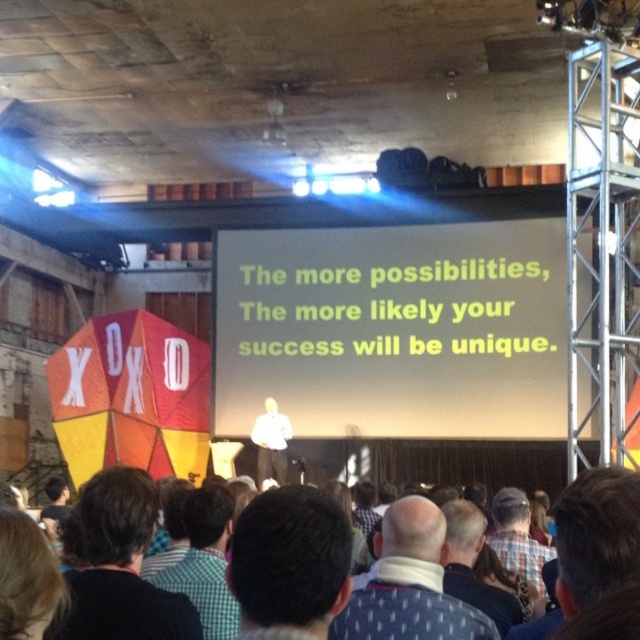
Can you confirm if brown hair at lower center is positioned to the left of white fabric at center?

Yes, brown hair at lower center is to the left of white fabric at center.

Is brown hair at lower center to the right of white fabric at center from the viewer's perspective?

In fact, brown hair at lower center is to the left of white fabric at center.

Which is in front, point (195, 636) or point (497, 634)?

Point (497, 634)

The width and height of the screenshot is (640, 640). I want to click on brown hair at lower center, so click(120, 566).

Who is shorter, checkered shirt at lower center or plaid shirt at center?

checkered shirt at lower center is shorter.

Is checkered shirt at lower center closer to the viewer compared to plaid shirt at center?

Yes.

Locate an element on the screen. checkered shirt at lower center is located at coordinates (205, 561).

Does white matte projection screen at center have a larger size compared to plaid shirt at center?

Yes.

Does white matte projection screen at center appear on the left side of plaid shirt at center?

Yes, white matte projection screen at center is to the left of plaid shirt at center.

Who is more distant from viewer, (416, 284) or (513, 515)?

Point (416, 284)

In order to click on white matte projection screen at center in this screenshot , I will do [x=394, y=330].